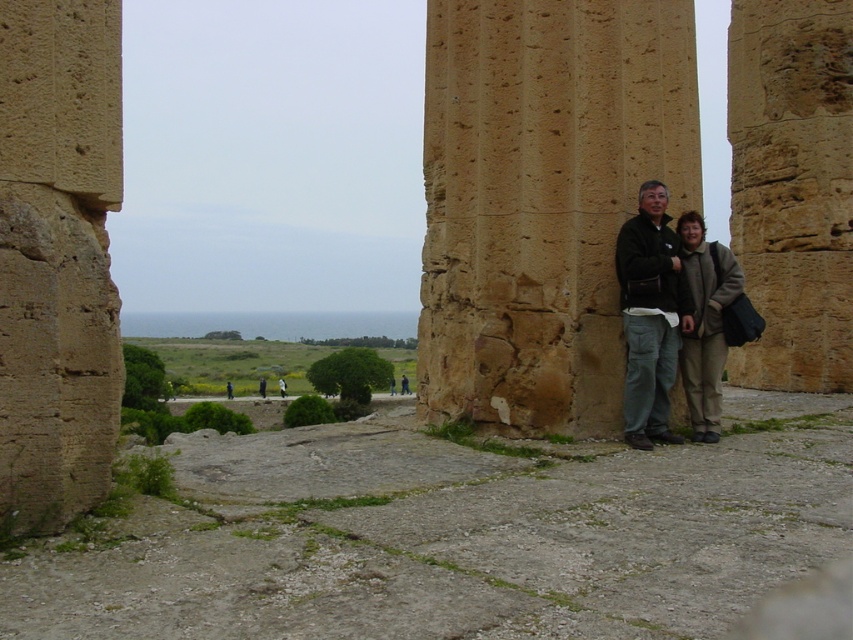
Does brown rough stone pillar at right appear on the left side of beige woolen coat at lower right?

Indeed, brown rough stone pillar at right is positioned on the left side of beige woolen coat at lower right.

Consider the image. Between brown rough stone pillar at right and beige woolen coat at lower right, which one appears on the right side from the viewer's perspective?

Positioned to the right is beige woolen coat at lower right.

Who is more forward, (x=590, y=356) or (x=723, y=288)?

Point (x=590, y=356) is more forward.

Locate an element on the screen. The height and width of the screenshot is (640, 853). brown rough stone pillar at right is located at coordinates (543, 198).

Is point (546, 339) in front of point (647, 243)?

No, (546, 339) is further to viewer.

Which is behind, point (440, 376) or point (659, 387)?

The point (440, 376) is behind.

This screenshot has height=640, width=853. I want to click on brown rough stone pillar at right, so pyautogui.click(x=543, y=198).

Can you confirm if beige stone pillar at center is bigger than matte brown jacket at center?

Incorrect, beige stone pillar at center is not larger than matte brown jacket at center.

Between point (39, 424) and point (717, 400), which one is positioned in front?

Point (39, 424) is in front.

Where is `beige stone pillar at center`? beige stone pillar at center is located at coordinates (57, 256).